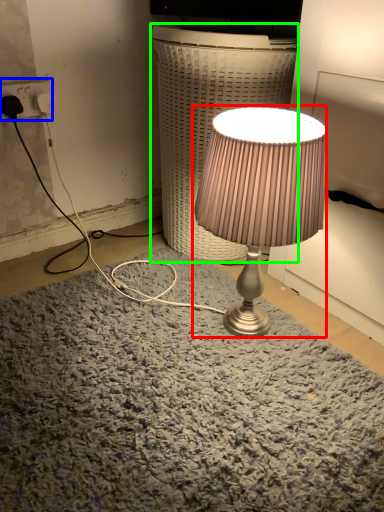
Question: Considering the real-world distances, which object is closest to lamp (highlighted by a red box)? electric outlet (highlighted by a blue box) or table (highlighted by a green box).

Choices:
 (A) electric outlet
 (B) table

Answer: (B)